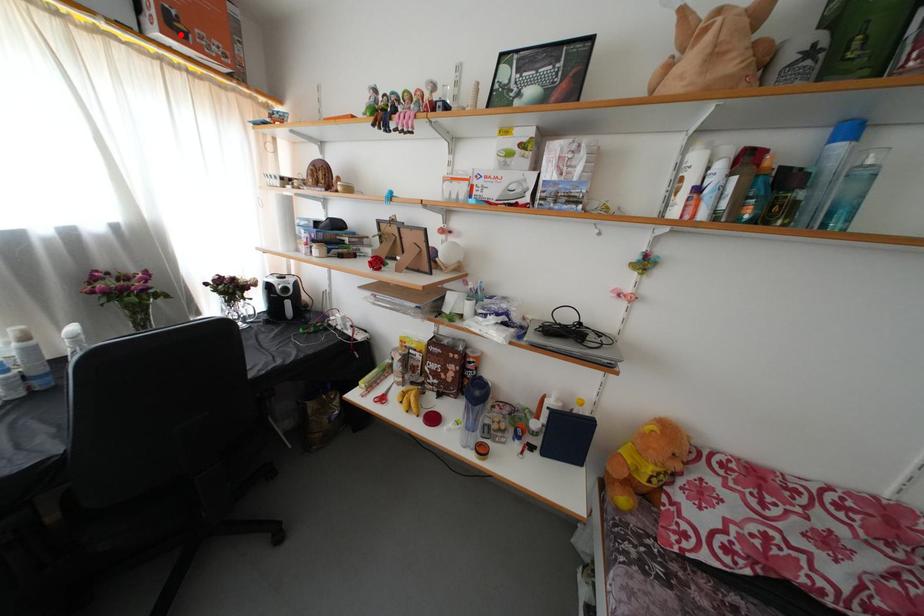
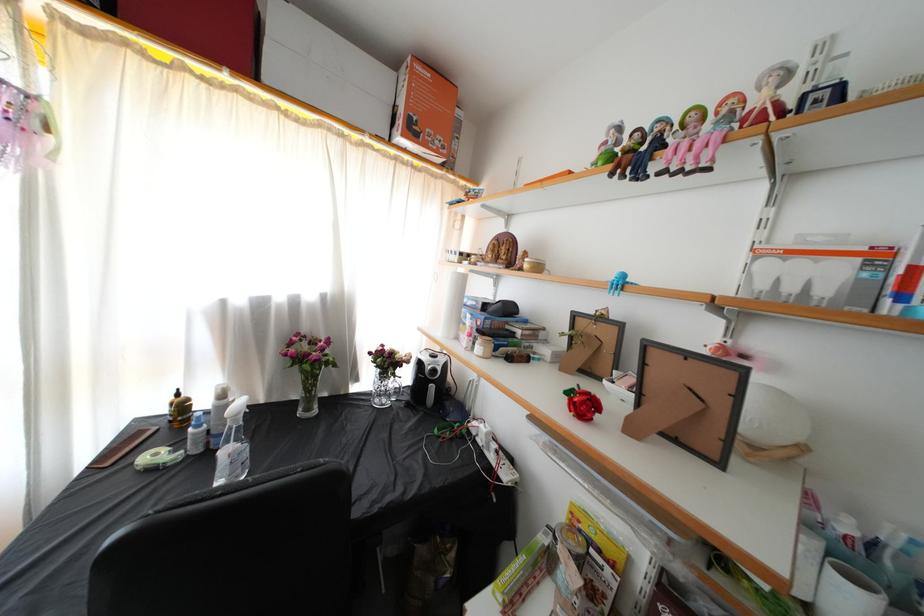
In the second image, find the point that corresponds to the highlighted location in the first image.

(418, 137)